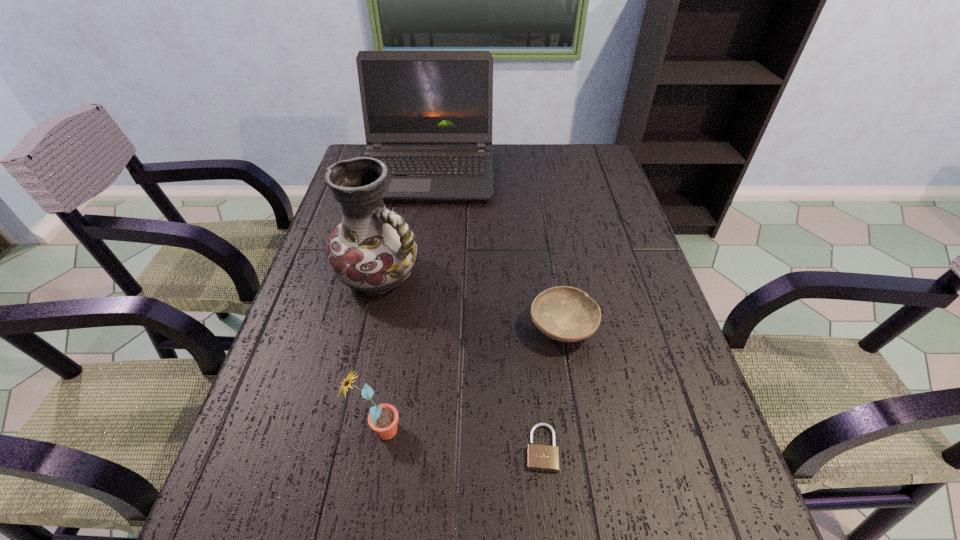
Locate an element on the screen. The height and width of the screenshot is (540, 960). object that is positioned at the far edge is located at coordinates (427, 115).

You are a GUI agent. You are given a task and a screenshot of the screen. Output one action in this format:
    pyautogui.click(x=<x>, y=<y>)
    Task: Click on the laptop_computer situated at the left edge
    
    Given the screenshot: What is the action you would take?
    pyautogui.click(x=427, y=115)

I want to click on vase that is at the left edge, so click(373, 250).

The height and width of the screenshot is (540, 960). Identify the location of object that is at the far left corner. (427, 115).

At what (x,y) coordinates should I click in order to perform the action: click on free space at the far edge. Please return your answer as a coordinate pair (x, y). This screenshot has width=960, height=540. Looking at the image, I should click on (534, 167).

You are a GUI agent. You are given a task and a screenshot of the screen. Output one action in this format:
    pyautogui.click(x=<x>, y=<y>)
    Task: Click on the vacant space at the near edge
    The width and height of the screenshot is (960, 540).
    Given the screenshot: What is the action you would take?
    pyautogui.click(x=571, y=537)

Where is `vacant space at the left edge of the desktop`? The width and height of the screenshot is (960, 540). vacant space at the left edge of the desktop is located at coordinates (348, 294).

Find the location of `vacant space at the right edge of the desktop`. vacant space at the right edge of the desktop is located at coordinates (617, 212).

At what (x,y) coordinates should I click in order to perform the action: click on free space at the far right corner of the desktop. Please return your answer as a coordinate pair (x, y). Looking at the image, I should click on (565, 173).

Where is `vacant space in between the vase and the sunflower`? The image size is (960, 540). vacant space in between the vase and the sunflower is located at coordinates (379, 353).